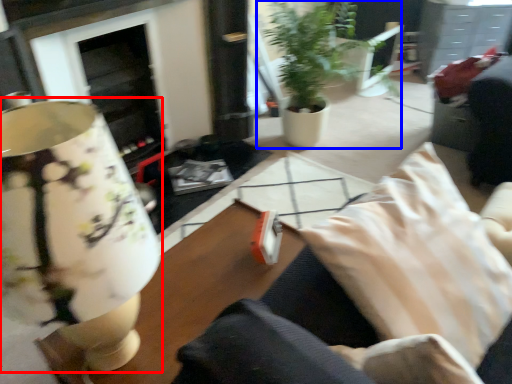
Question: Which object appears farthest to the camera in this image, table lamp (highlighted by a red box) or houseplant (highlighted by a blue box)?

Choices:
 (A) table lamp
 (B) houseplant

Answer: (B)